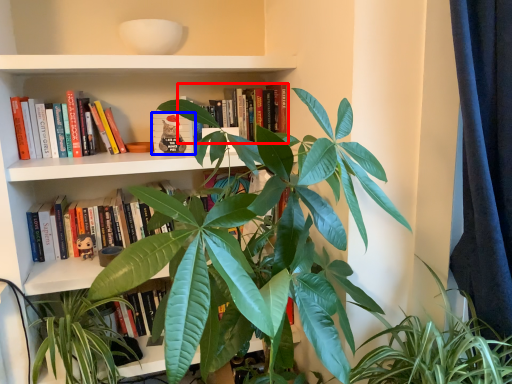
Question: Which object is further to the camera taking this photo, book (highlighted by a red box) or book (highlighted by a blue box)?

Choices:
 (A) book
 (B) book

Answer: (B)